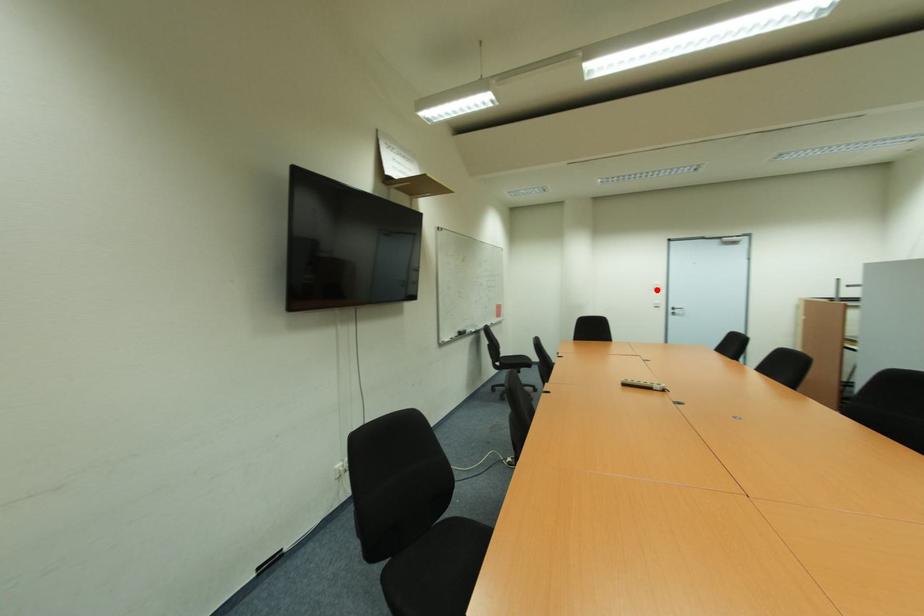
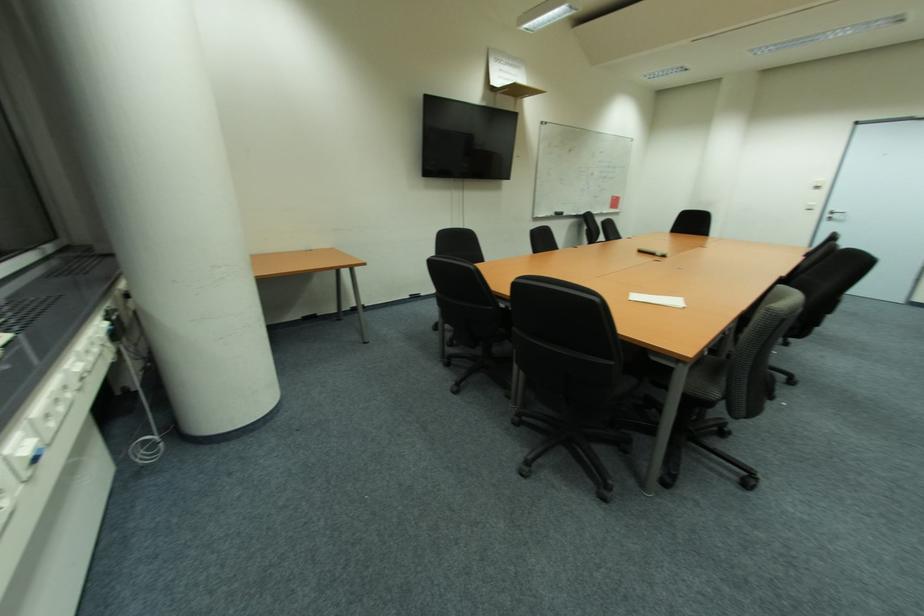
Question: I am providing you with two images of the same scene from different viewpoints. Image1 has a red point marked. In image2, the corresponding 3D location appears at what relative position? Reply with the corresponding letter.

Choices:
 (A) Closer
 (B) Farther

Answer: (B)